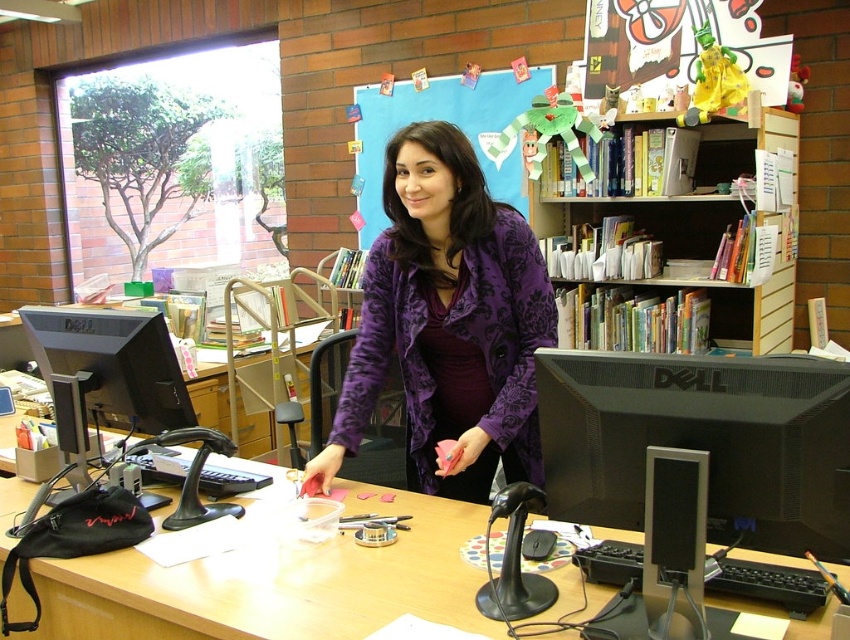
You are standing in the library and want to take a photo of the point at coordinates (x=434, y=440). The camera you are using has a minimum focus distance of 6 feet. Will the camera be able to focus on the point?

The point at coordinates (x=434, y=440) is 6.41 feet away from the camera. Since the minimum focus distance is 6 feet, the camera can focus on the point because it is within the required distance.

You are organizing the desk and want to place the purple velvet jacket at center and the black glossy monitor at left side by side. Which object requires more horizontal space?

The purple velvet jacket at center requires more horizontal space because its width is larger than the black glossy monitor at left.

You are a visitor in the library and see the purple velvet jacket at center and the black glossy monitor at left on the desk. Which object is taller?

The purple velvet jacket at center is much taller than the black glossy monitor at left.